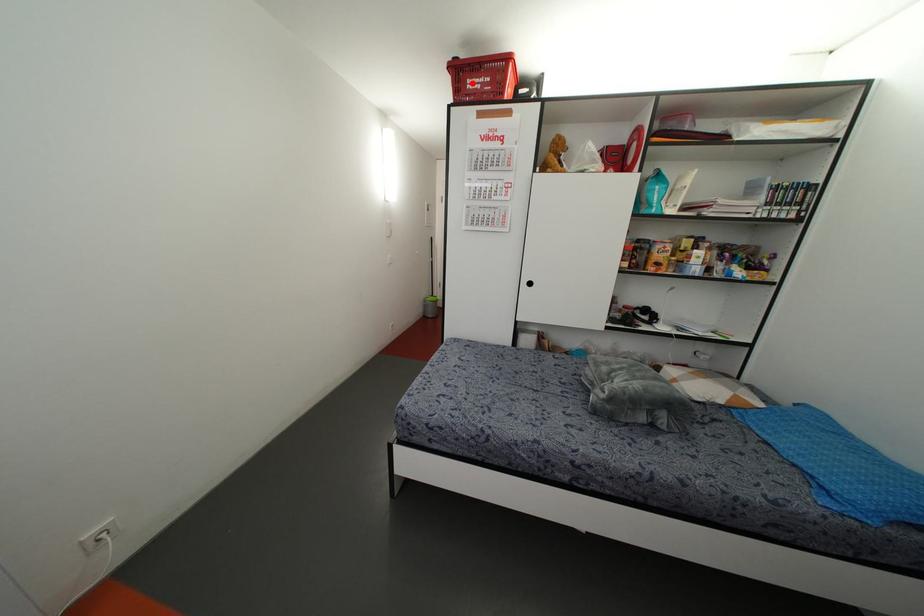
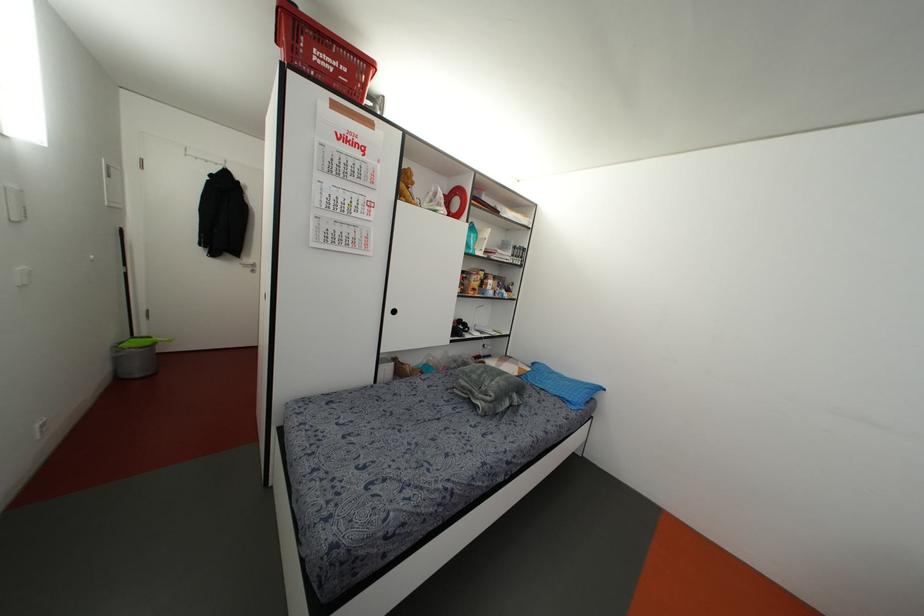
The point at the highlighted location is marked in the first image. Where is the corresponding point in the second image?

(322, 59)